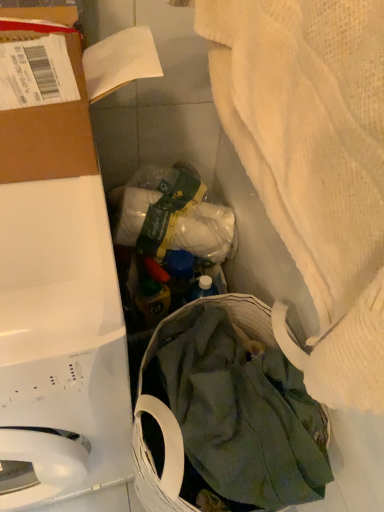
Question: From a real-world perspective, is green cotton cloth at lower center physically below white fabric at center?

Choices:
 (A) yes
 (B) no

Answer: (A)

Question: Is green cotton cloth at lower center taller than white fabric at center?

Choices:
 (A) yes
 (B) no

Answer: (A)

Question: Is green cotton cloth at lower center placed right next to white fabric at center?

Choices:
 (A) no
 (B) yes

Answer: (A)

Question: Is white fabric at center at the back of green cotton cloth at lower center?

Choices:
 (A) yes
 (B) no

Answer: (A)

Question: From a real-world perspective, is green cotton cloth at lower center physically above white fabric at center?

Choices:
 (A) yes
 (B) no

Answer: (B)

Question: Is green cotton cloth at lower center closer to camera compared to white fabric at center?

Choices:
 (A) no
 (B) yes

Answer: (B)

Question: Does brown cardboard at upper left have a lesser height compared to white textured towel at upper right?

Choices:
 (A) yes
 (B) no

Answer: (A)

Question: Is the position of brown cardboard at upper left more distant than that of white textured towel at upper right?

Choices:
 (A) no
 (B) yes

Answer: (B)

Question: Considering the relative positions of brown cardboard at upper left and white textured towel at upper right in the image provided, is brown cardboard at upper left to the right of white textured towel at upper right from the viewer's perspective?

Choices:
 (A) no
 (B) yes

Answer: (A)

Question: Is brown cardboard at upper left closer to camera compared to white textured towel at upper right?

Choices:
 (A) yes
 (B) no

Answer: (B)

Question: Considering the relative positions of brown cardboard at upper left and white textured towel at upper right in the image provided, is brown cardboard at upper left to the left of white textured towel at upper right from the viewer's perspective?

Choices:
 (A) no
 (B) yes

Answer: (B)

Question: Is brown cardboard at upper left turned away from white textured towel at upper right?

Choices:
 (A) no
 (B) yes

Answer: (A)

Question: From the image's perspective, is white fabric at center under white glossy washing machine at left?

Choices:
 (A) no
 (B) yes

Answer: (A)